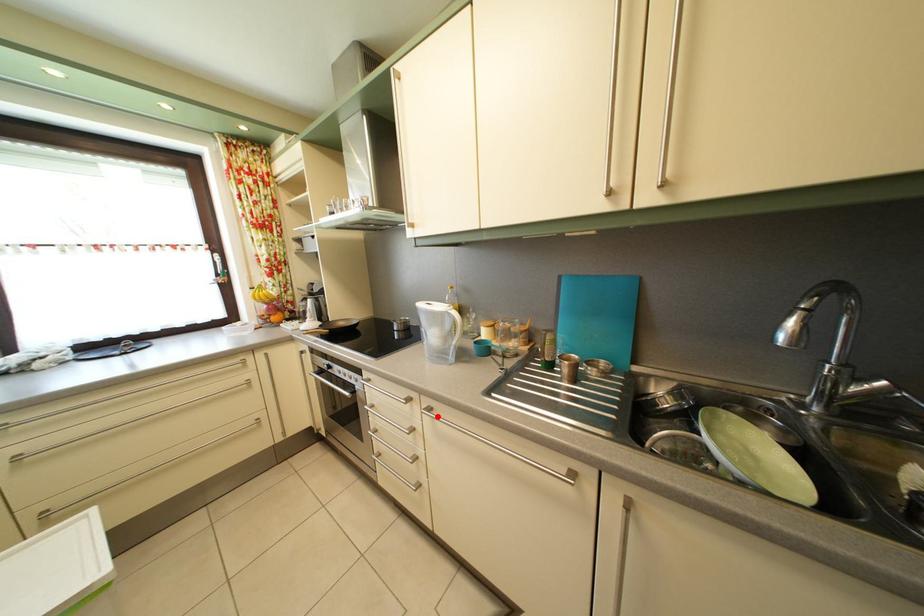
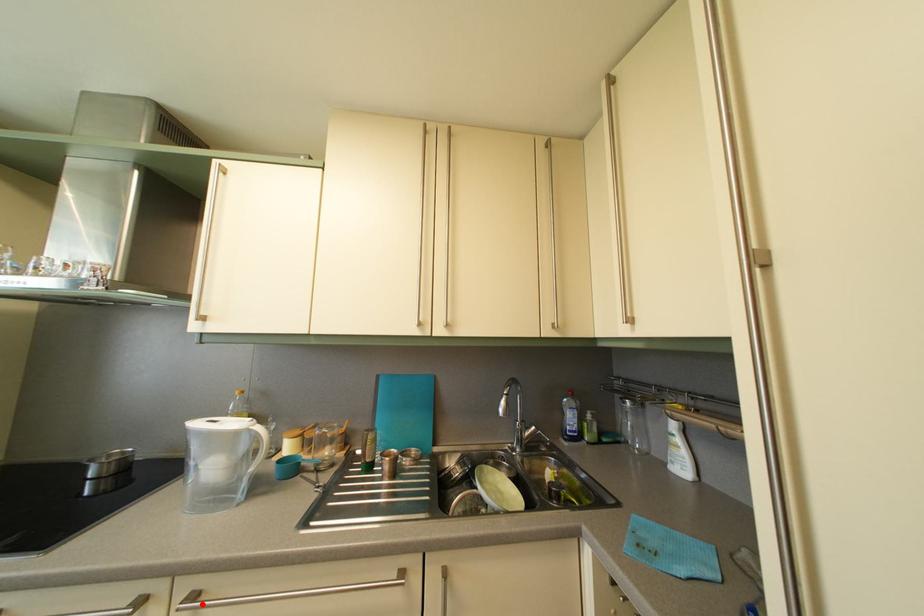
I am providing you with two images of the same scene from different viewpoints. A red point is marked on the first image and another point is marked on the second image. Does the point marked in image1 correspond to the same location as the one in image2?

Yes